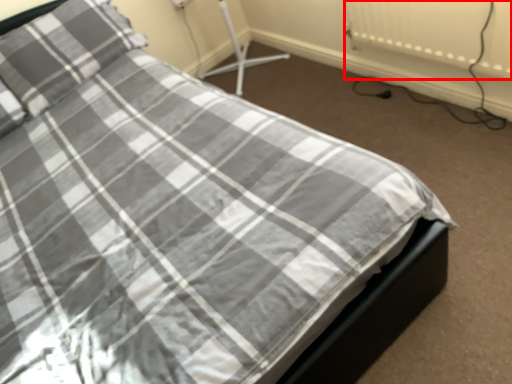
Question: From the image, what is the correct spatial relationship of radiator (annotated by the red box) in relation to pillow?

Choices:
 (A) left
 (B) right

Answer: (B)